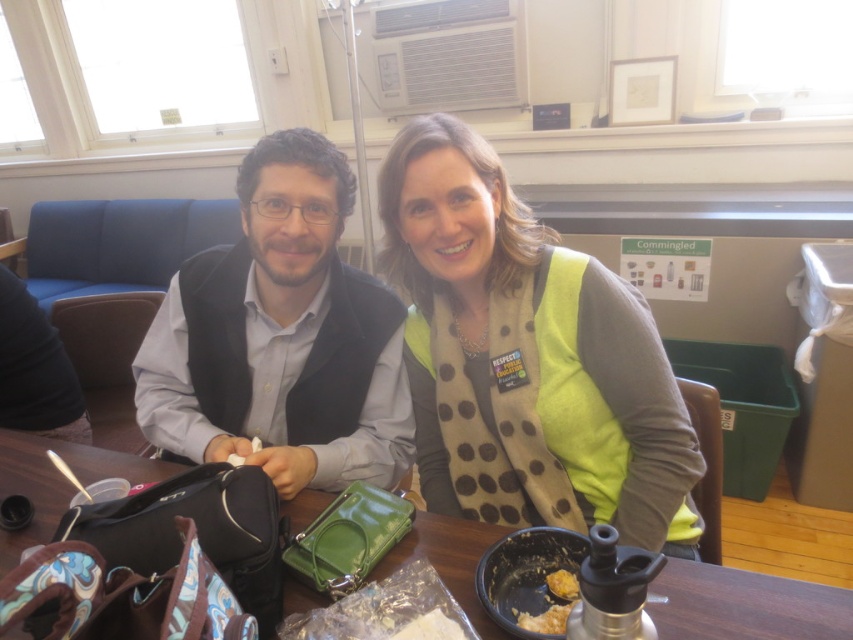
Question: Does green polka dot scarf at center appear on the left side of matte black vest at center?

Choices:
 (A) yes
 (B) no

Answer: (B)

Question: Which is farther from the matte black vest at center?

Choices:
 (A) wooden table at center
 (B) green polka dot scarf at center

Answer: (A)

Question: Which of these objects is positioned farthest from the wooden table at center?

Choices:
 (A) green polka dot scarf at center
 (B) matte black vest at center

Answer: (B)

Question: Which object is closer to the camera taking this photo?

Choices:
 (A) green polka dot scarf at center
 (B) wooden table at center

Answer: (B)

Question: From the image, what is the correct spatial relationship of green polka dot scarf at center in relation to wooden table at center?

Choices:
 (A) below
 (B) above

Answer: (B)

Question: Can you confirm if matte black vest at center is smaller than wooden table at center?

Choices:
 (A) yes
 (B) no

Answer: (B)